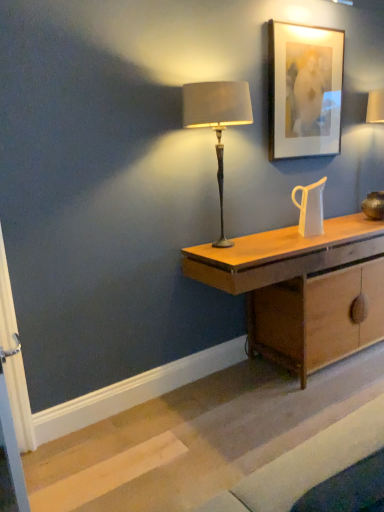
Question: Can you confirm if transparent glass jug at center is wider than matte beige fabric lampshade at center?

Choices:
 (A) yes
 (B) no

Answer: (B)

Question: Can you confirm if transparent glass jug at center is taller than matte beige fabric lampshade at center?

Choices:
 (A) yes
 (B) no

Answer: (B)

Question: From a real-world perspective, is transparent glass jug at center located beneath matte beige fabric lampshade at center?

Choices:
 (A) yes
 (B) no

Answer: (A)

Question: From the image's perspective, is transparent glass jug at center below matte beige fabric lampshade at center?

Choices:
 (A) no
 (B) yes

Answer: (B)

Question: Considering the relative positions of transparent glass jug at center and matte beige fabric lampshade at center in the image provided, is transparent glass jug at center in front of matte beige fabric lampshade at center?

Choices:
 (A) no
 (B) yes

Answer: (A)

Question: Does transparent glass jug at center lie behind matte beige fabric lampshade at center?

Choices:
 (A) yes
 (B) no

Answer: (A)

Question: Could you tell me if wooden desk at center is turned towards matte wooden picture frame at upper right?

Choices:
 (A) yes
 (B) no

Answer: (B)

Question: From a real-world perspective, is wooden desk at center located beneath matte wooden picture frame at upper right?

Choices:
 (A) no
 (B) yes

Answer: (B)

Question: Considering the relative positions of wooden desk at center and matte wooden picture frame at upper right in the image provided, is wooden desk at center behind matte wooden picture frame at upper right?

Choices:
 (A) yes
 (B) no

Answer: (B)

Question: Can you confirm if wooden desk at center is wider than matte wooden picture frame at upper right?

Choices:
 (A) yes
 (B) no

Answer: (A)

Question: From the image's perspective, is wooden desk at center beneath matte wooden picture frame at upper right?

Choices:
 (A) yes
 (B) no

Answer: (A)

Question: From a real-world perspective, does wooden desk at center stand above matte wooden picture frame at upper right?

Choices:
 (A) no
 (B) yes

Answer: (A)

Question: Considering the relative sizes of matte wooden picture frame at upper right and wooden desk at center in the image provided, is matte wooden picture frame at upper right bigger than wooden desk at center?

Choices:
 (A) no
 (B) yes

Answer: (A)